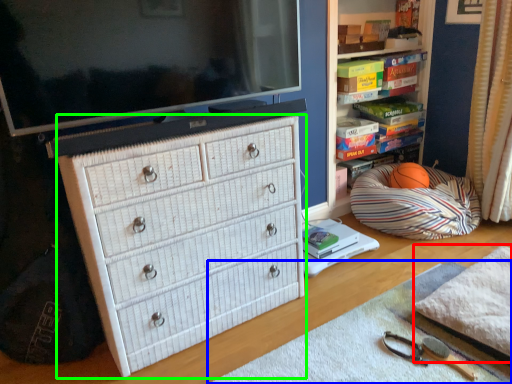
Question: Considering the real-world distances, which object is farthest from blanket (highlighted by a red box)? plain (highlighted by a blue box) or chest of drawers (highlighted by a green box)?

Choices:
 (A) plain
 (B) chest of drawers

Answer: (B)